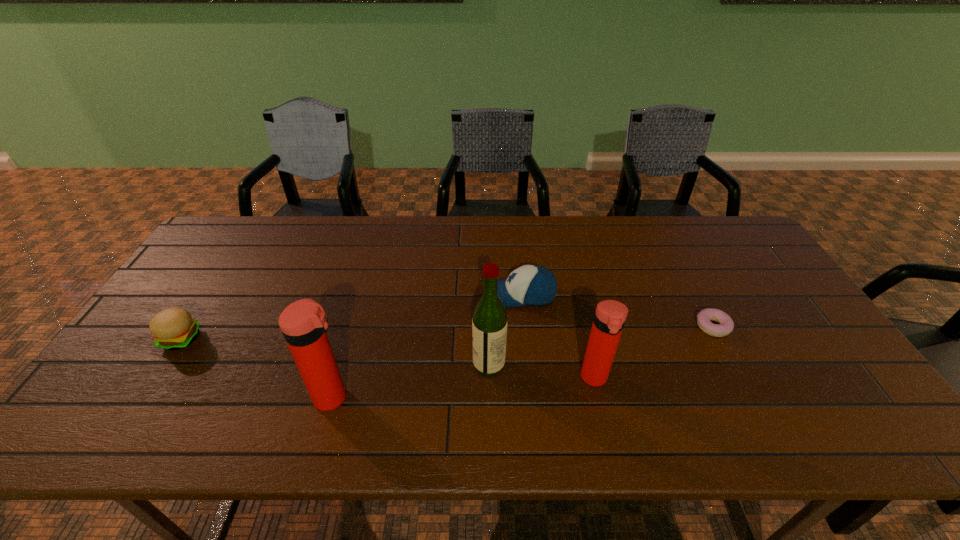
In the current image, all thermos bottles are evenly spaced. To maintain this equal spacing, where should an additional thermos bottle be placed on the right? Please point out a free spot. Please provide its 2D coordinates. Your answer should be formatted as a tuple, i.e. [(x, y)], where the tuple contains the x and y coordinates of a point satisfying the conditions above.

[(837, 360)]